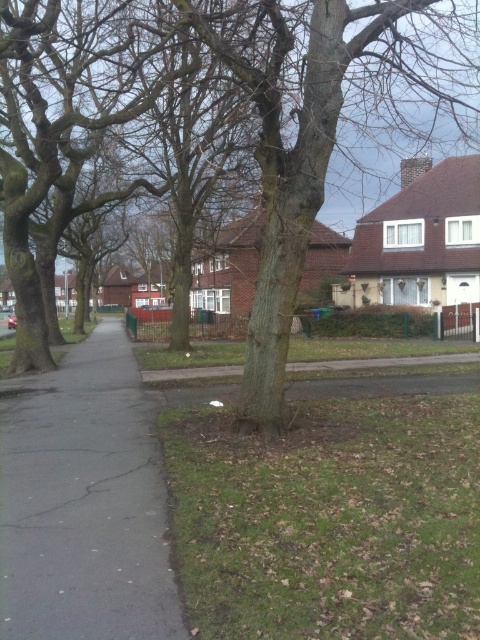
Question: Can you confirm if brown rough tree at center is positioned above black asphalt pavement at left?

Choices:
 (A) no
 (B) yes

Answer: (B)

Question: Where is brown rough tree at center located in relation to black asphalt pavement at left in the image?

Choices:
 (A) left
 (B) right

Answer: (B)

Question: Is brown rough tree at center below black asphalt pavement at left?

Choices:
 (A) yes
 (B) no

Answer: (B)

Question: Among these objects, which one is nearest to the camera?

Choices:
 (A) black asphalt pavement at left
 (B) brown rough tree at center

Answer: (A)

Question: Which point appears farthest from the camera in this image?

Choices:
 (A) coord(132,508)
 (B) coord(11,177)

Answer: (B)